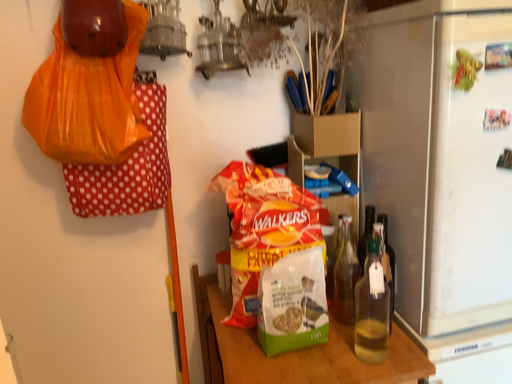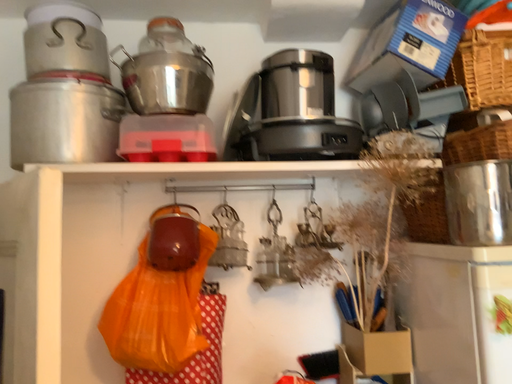
Question: How did the camera likely rotate when shooting the video?

Choices:
 (A) rotated downward
 (B) rotated upward

Answer: (B)